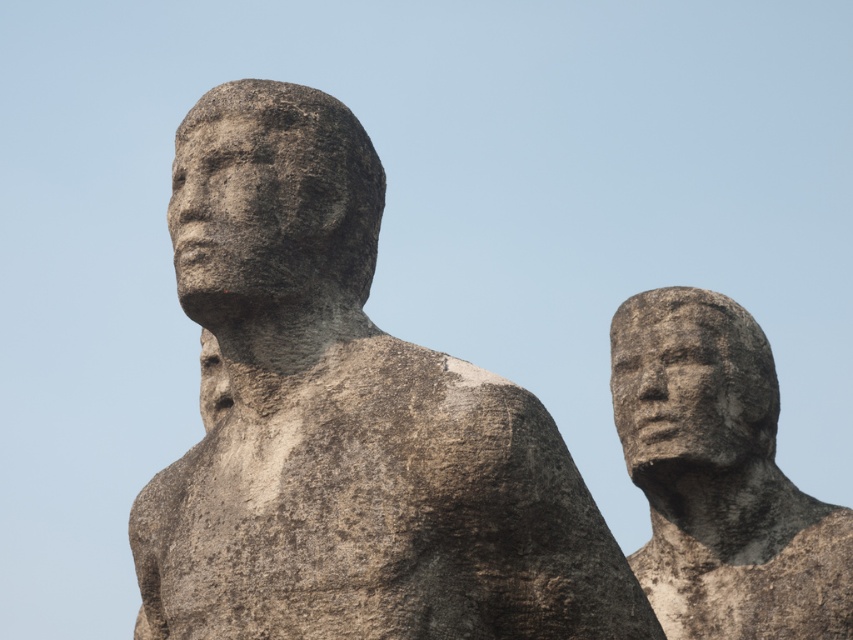
You are a photographer standing at the camera position. You want to take a photo of the gray stone statue at center. The statue is 51.44 meters away from you. If your camera has a maximum focus range of 50 meters, will you be able to focus on the statue?

The gray stone statue at center is 51.44 meters away from the camera, which exceeds the camera maximum focus range of 50 meters. Therefore, the camera cannot focus on the statue.